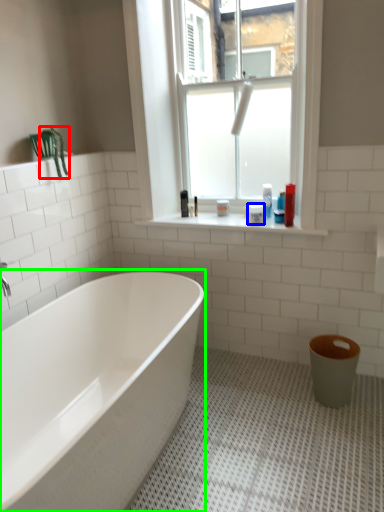
Question: Which object is the farthest from plant (highlighted by a red box)? Choose among these: toiletry (highlighted by a blue box) or bathtub (highlighted by a green box).

Choices:
 (A) toiletry
 (B) bathtub

Answer: (B)